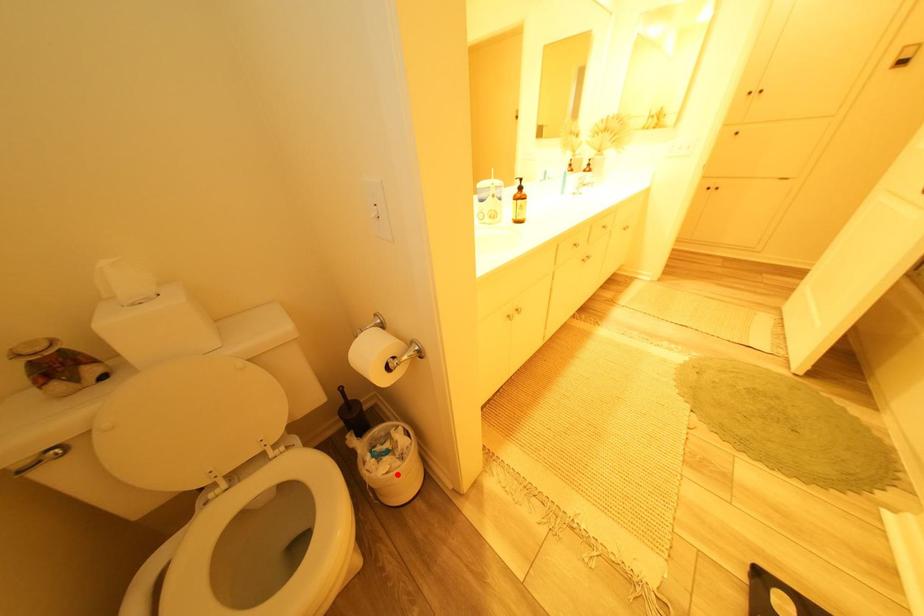
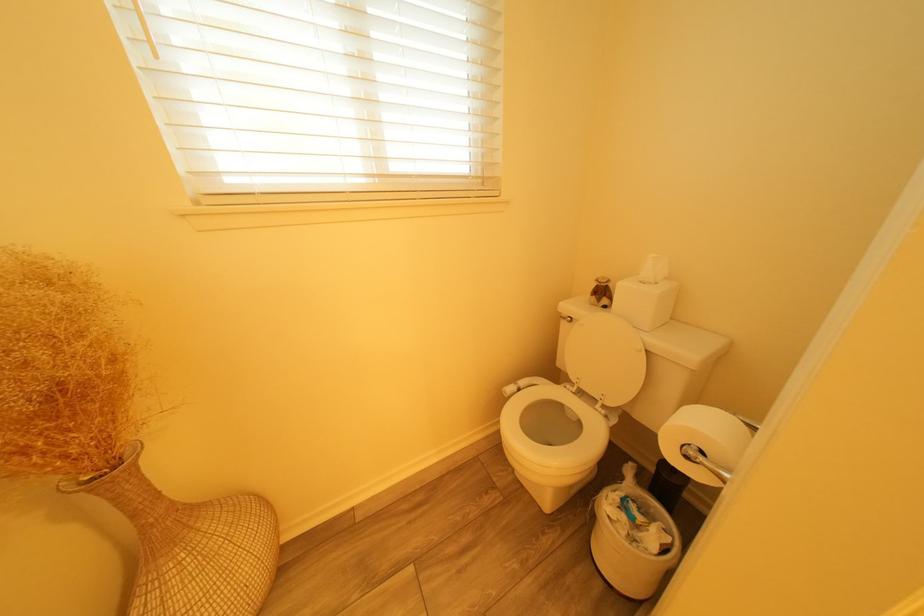
Find the pixel in the second image that matches the highlighted location in the first image.

(619, 519)